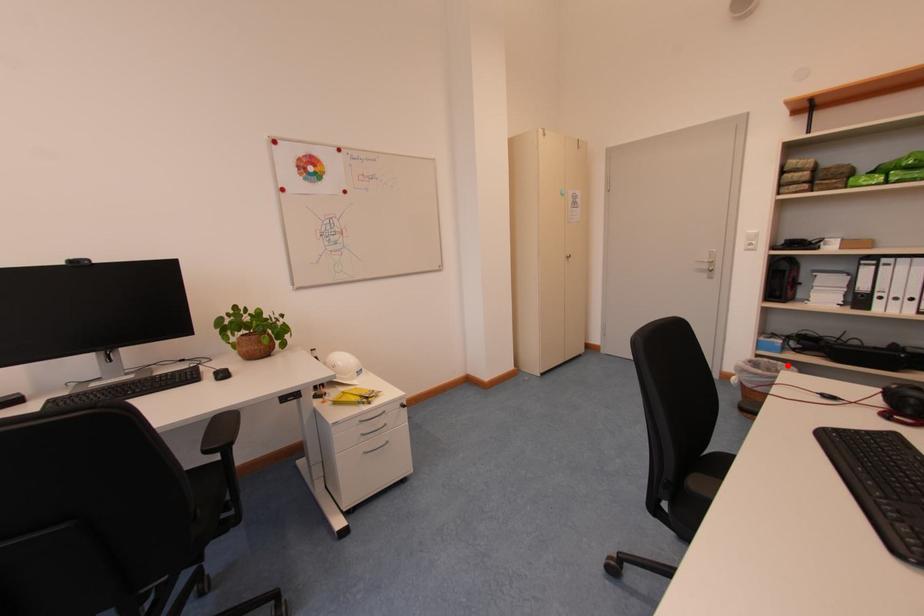
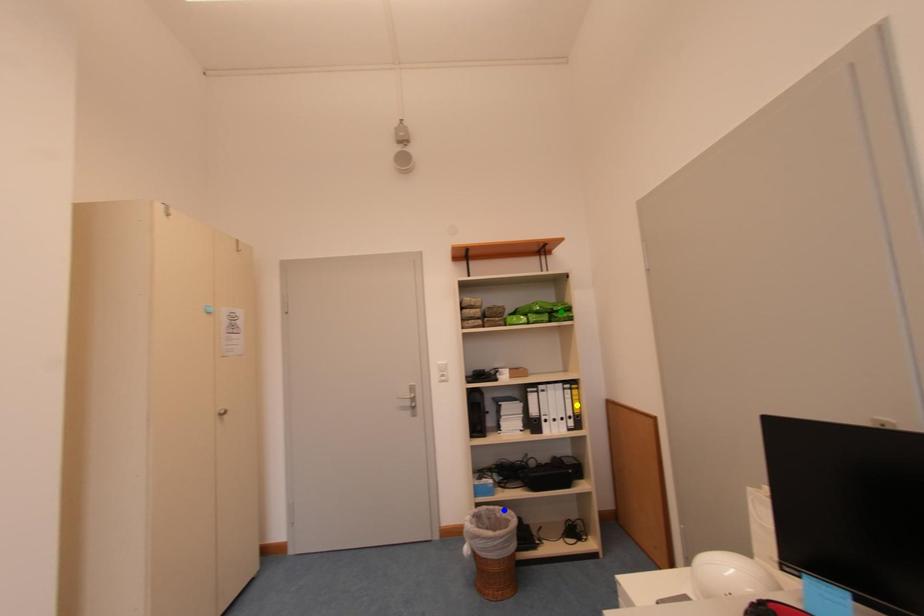
Question: I am providing you with two images of the same scene from different viewpoints. A red point is marked on the first image. You are given multiple points on the second image. Which spot in image 2 lines up with the point in image 1?

Choices:
 (A) blue point
 (B) yellow point
 (C) green point

Answer: (A)